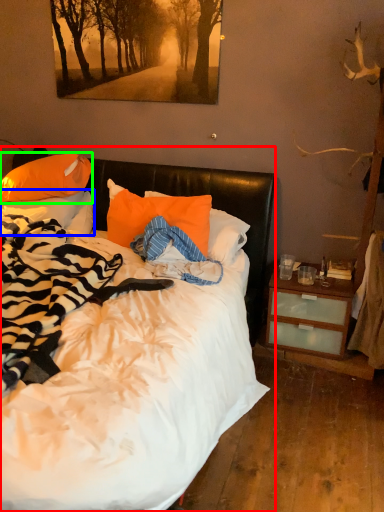
Question: Estimate the real-world distances between objects in this image. Which object is closer to bed (highlighted by a red box), pillow (highlighted by a blue box) or pillow (highlighted by a green box)?

Choices:
 (A) pillow
 (B) pillow

Answer: (A)